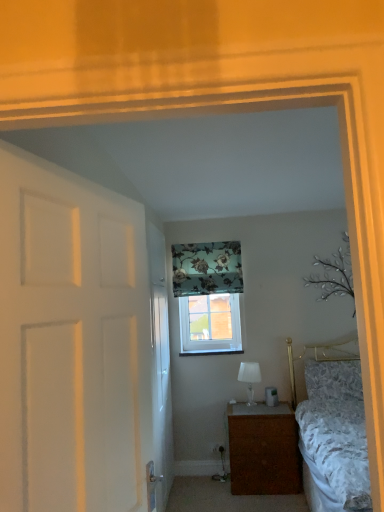
How much space does white glossy door at center, which is counted as the first door, starting from the back, occupy horizontally?

The width of white glossy door at center, which is counted as the first door, starting from the back, is 6.99 centimeters.

This screenshot has height=512, width=384. I want to click on brown wood nightstand at lower center, so click(264, 450).

This screenshot has width=384, height=512. I want to click on white glossy table lamp at center, so click(x=249, y=378).

Locate an element on the screen. The image size is (384, 512). white matte door at left, the first door viewed from the front is located at coordinates click(71, 342).

Locate an element on the screen. Image resolution: width=384 pixels, height=512 pixels. clear glass window at center is located at coordinates (210, 324).

There is a white glossy table lamp at center. What are the coordinates of `the 2nd door above it (from the image's perspective)` in the screenshot? It's located at (71, 342).

Consider the image. Is white matte door at left, which is counted as the second door, starting from the back, placed right next to white glossy table lamp at center?

No.

From the image's perspective, between white matte door at left, the first door viewed from the front, and white glossy table lamp at center, which one is located above?

white matte door at left, the first door viewed from the front, is shown above in the image.

Is white matte door at left, the first door viewed from the front, surrounding white glossy table lamp at center?

No, white glossy table lamp at center is not inside white matte door at left, the first door viewed from the front.

Is floral fabric curtain at upper center spatially inside clear glass window at center, or outside of it?

The correct answer is: outside.

Can you see floral fabric curtain at upper center touching clear glass window at center?

floral fabric curtain at upper center and clear glass window at center are clearly separated.

From a real-world perspective, is floral fabric curtain at upper center located higher than clear glass window at center?

Correct, in the physical world, floral fabric curtain at upper center is higher than clear glass window at center.

Considering the positions of objects floral fabric curtain at upper center and clear glass window at center in the image provided, who is more to the left, floral fabric curtain at upper center or clear glass window at center?

floral fabric curtain at upper center.

Is brown wood nightstand at lower center closer to the viewer compared to white glossy door at center, which is counted as the first door, starting from the back?

No, brown wood nightstand at lower center is further to the viewer.

Does brown wood nightstand at lower center turn towards white glossy door at center, the 2th door positioned from the front?

No, brown wood nightstand at lower center is not oriented towards white glossy door at center, the 2th door positioned from the front.

Would you say brown wood nightstand at lower center contains white glossy door at center, which is counted as the first door, starting from the back?

Definitely not — white glossy door at center, which is counted as the first door, starting from the back, is not inside brown wood nightstand at lower center.

Is brown wood nightstand at lower center at the left side of white glossy door at center, the 2th door positioned from the front?

Incorrect, brown wood nightstand at lower center is not on the left side of white glossy door at center, the 2th door positioned from the front.

Consider the image. Who is shorter, white glossy table lamp at center or white matte door at left, which is counted as the second door, starting from the back?

white glossy table lamp at center.

Is white matte door at left, the first door viewed from the front, at the back of white glossy table lamp at center?

No.

In terms of size, does white glossy table lamp at center appear bigger or smaller than white matte door at left, which is counted as the second door, starting from the back?

Considering their sizes, white glossy table lamp at center takes up less space than white matte door at left, which is counted as the second door, starting from the back.

Is white glossy table lamp at center wider or thinner than white matte door at left, which is counted as the second door, starting from the back?

Clearly, white glossy table lamp at center has more width compared to white matte door at left, which is counted as the second door, starting from the back.

Considering the relative positions of clear glass window at center and white glossy door at center, the 2th door positioned from the front, in the image provided, is clear glass window at center to the right of white glossy door at center, the 2th door positioned from the front, from the viewer's perspective?

Yes.

Between clear glass window at center and white glossy door at center, which is counted as the first door, starting from the back, which one has smaller size?

Smaller between the two is clear glass window at center.

Between clear glass window at center and white glossy door at center, the 2th door positioned from the front, which one has smaller width?

white glossy door at center, the 2th door positioned from the front, is thinner.

Find the location of a particular element. The width and height of the screenshot is (384, 512). the 1st door counting from the left of the clear glass window at center is located at coordinates click(160, 365).

Consider the image. Which of these two, brown wood nightstand at lower center or white glossy table lamp at center, stands taller?

Standing taller between the two is brown wood nightstand at lower center.

Which is behind, brown wood nightstand at lower center or white glossy table lamp at center?

Positioned behind is white glossy table lamp at center.

Consider the image. From a real-world perspective, is brown wood nightstand at lower center above or below white glossy table lamp at center?

From a real-world perspective, brown wood nightstand at lower center is physically below white glossy table lamp at center.

Considering the sizes of objects brown wood nightstand at lower center and white glossy table lamp at center in the image provided, who is thinner, brown wood nightstand at lower center or white glossy table lamp at center?

white glossy table lamp at center.

From the image's perspective, is fluffy white pillow at right over white matte door at left, which is counted as the second door, starting from the back?

No, from the image's perspective, fluffy white pillow at right is not over white matte door at left, which is counted as the second door, starting from the back.

Is fluffy white pillow at right wider than white matte door at left, which is counted as the second door, starting from the back?

Indeed, fluffy white pillow at right has a greater width compared to white matte door at left, which is counted as the second door, starting from the back.

From the picture: From a real-world perspective, which object rests below the other?

fluffy white pillow at right is physically lower.

Find the location of a particular element. Image resolution: width=384 pixels, height=512 pixels. table lamp below the white matte door at left, the first door viewed from the front (from the image's perspective) is located at coordinates (249, 378).

The width and height of the screenshot is (384, 512). In order to click on window directly beneath the floral fabric curtain at upper center (from a real-world perspective) in this screenshot , I will do `click(210, 324)`.

Estimate the real-world distances between objects in this image. Which object is further from white glossy table lamp at center, white matte door at left, the first door viewed from the front, or fluffy white pillow at right?

The object further to white glossy table lamp at center is white matte door at left, the first door viewed from the front.

Considering their positions, is clear glass window at center positioned further to floral fabric curtain at upper center than white glossy table lamp at center?

white glossy table lamp at center is positioned further to the anchor floral fabric curtain at upper center.

Estimate the real-world distances between objects in this image. Which object is further from white glossy door at center, which is counted as the first door, starting from the back, fluffy white pillow at right or brown wood nightstand at lower center?

Based on the image, fluffy white pillow at right appears to be further to white glossy door at center, which is counted as the first door, starting from the back.

Estimate the real-world distances between objects in this image. Which object is further from white matte door at left, which is counted as the second door, starting from the back, white glossy door at center, the 2th door positioned from the front, or white glossy table lamp at center?

white glossy table lamp at center is further to white matte door at left, which is counted as the second door, starting from the back.

From the image, which object appears to be nearer to white glossy door at center, the 2th door positioned from the front, floral fabric curtain at upper center or fluffy white pillow at right?

The object closer to white glossy door at center, the 2th door positioned from the front, is floral fabric curtain at upper center.

Looking at the image, which one is located further to white glossy door at center, which is counted as the first door, starting from the back, white glossy table lamp at center or clear glass window at center?

white glossy table lamp at center is positioned further to the anchor white glossy door at center, which is counted as the first door, starting from the back.

When comparing their distances from white matte door at left, which is counted as the second door, starting from the back, does white glossy table lamp at center or white glossy door at center, which is counted as the first door, starting from the back, seem further?

white glossy table lamp at center is further to white matte door at left, which is counted as the second door, starting from the back.

When comparing their distances from white glossy door at center, which is counted as the first door, starting from the back, does floral fabric curtain at upper center or white glossy table lamp at center seem closer?

Based on the image, floral fabric curtain at upper center appears to be nearer to white glossy door at center, which is counted as the first door, starting from the back.

Image resolution: width=384 pixels, height=512 pixels. In order to click on nightstand between clear glass window at center and fluffy white pillow at right in the horizontal direction in this screenshot , I will do `click(264, 450)`.

Identify the location of table lamp between white glossy door at center, which is counted as the first door, starting from the back, and clear glass window at center from front to back. The width and height of the screenshot is (384, 512). (249, 378).

You are a GUI agent. You are given a task and a screenshot of the screen. Output one action in this format:
    pyautogui.click(x=<x>, y=<y>)
    Task: Click on the nightstand located between white matte door at left, which is counted as the second door, starting from the back, and fluffy white pillow at right in the depth direction
    The height and width of the screenshot is (512, 384).
    Given the screenshot: What is the action you would take?
    pyautogui.click(x=264, y=450)

Find the location of a particular element. door located between white matte door at left, the first door viewed from the front, and floral fabric curtain at upper center in the depth direction is located at coordinates (160, 365).